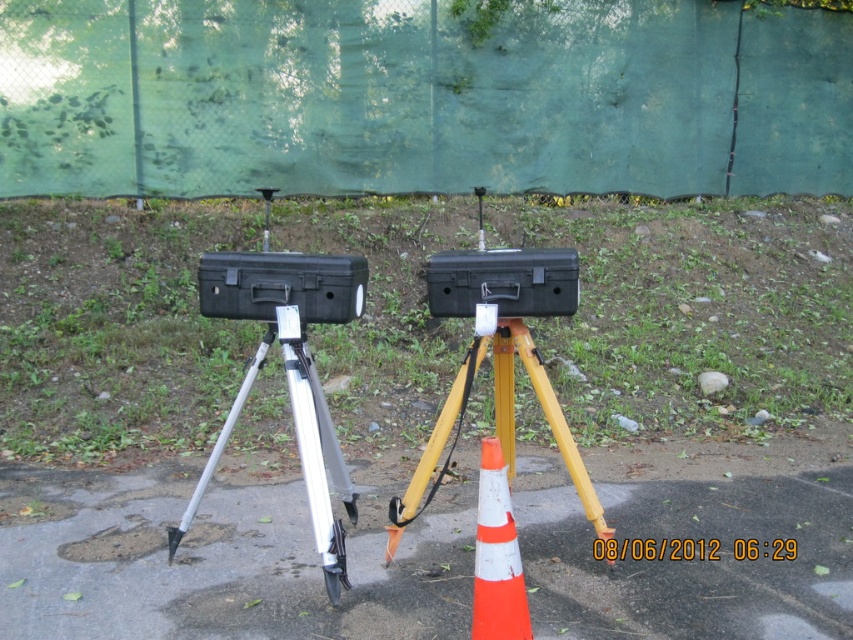
You are a delivery person who needs to move the silver metallic tripod at center and the black hard case at center to a storage room. To ensure safe transport, which object should be lifted first to avoid obstructing the other?

The silver metallic tripod at center should be lifted first because it is positioned under the black hard case at center, so lifting the tripod first would prevent the hard case from blocking access to it later.

You are a delivery person trying to place a box between the smooth asphalt pavement at center and the yellow metallic tripod at center. Based on their positions, which object should you place the box next to so it stays on the right side of the tripod?

The smooth asphalt pavement at center is positioned on the left side of yellow metallic tripod at center, so placing the box next to the yellow metallic tripod at center would keep it on the right side of the tripod.

You need to place a 1.5 meter tall ladder between the yellow metallic tripod at center and the black hard case at center. Which object should the ladder be placed closer to in order to ensure stability?

The ladder should be placed closer to the yellow metallic tripod at center since it has a greater height compared to the black hard case at center, providing a stable base for the ladder.